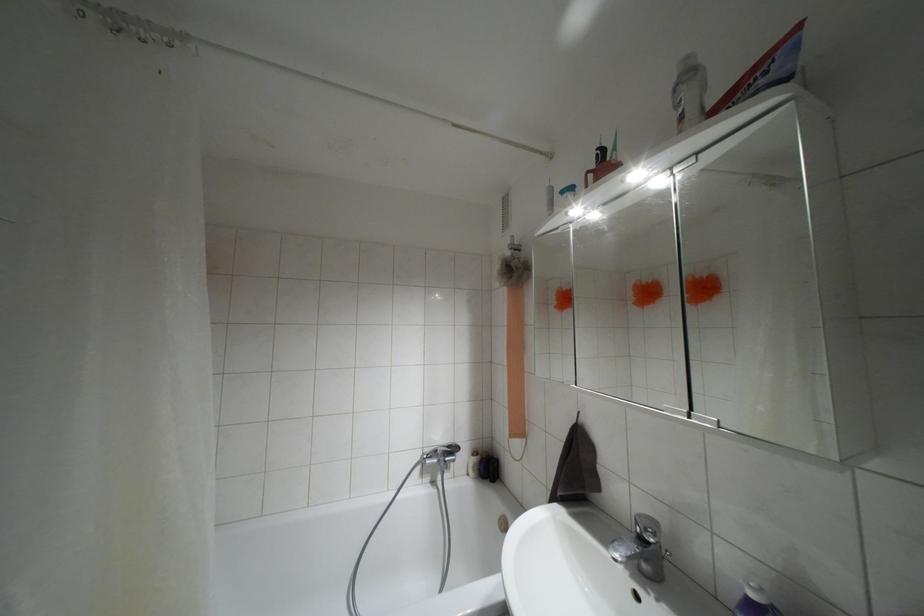
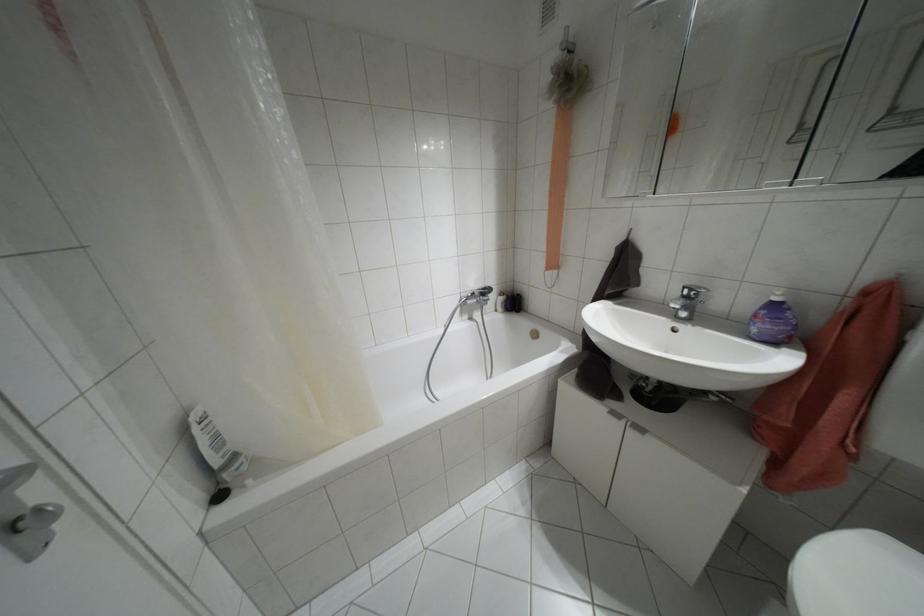
Question: The images are taken continuously from a first-person perspective. In which direction are you moving?

Choices:
 (A) Left
 (B) Right
 (C) Forward
 (D) Backward

Answer: (A)